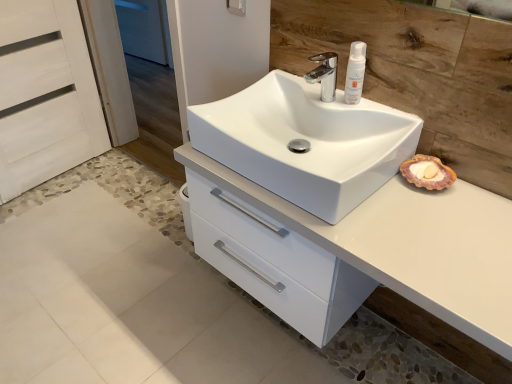
Locate an element on the screen. Image resolution: width=512 pixels, height=384 pixels. free location in front of white wood screen door at left, which is counted as the 2th screen door, starting from the right is located at coordinates (55, 228).